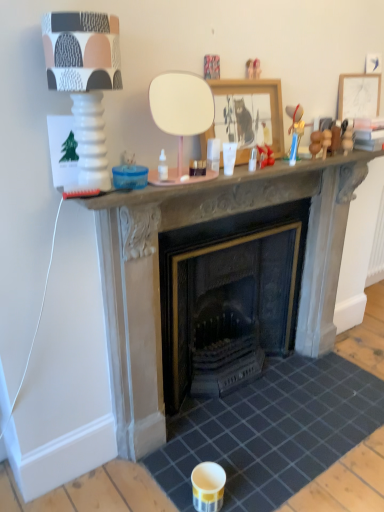
Image resolution: width=384 pixels, height=512 pixels. Find the location of `free space that is to the left of white glossy coffee cup at upper center`. free space that is to the left of white glossy coffee cup at upper center is located at coordinates (177, 179).